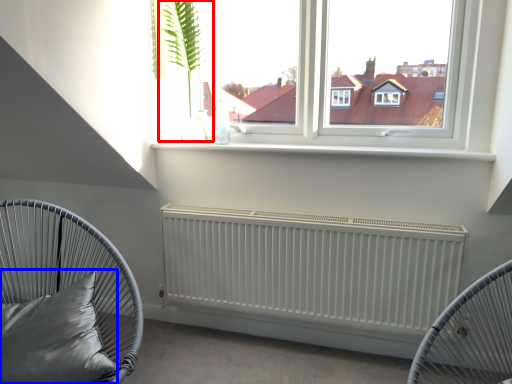
Question: Which point is further to the camera, plant (highlighted by a red box) or pillow (highlighted by a blue box)?

Choices:
 (A) plant
 (B) pillow

Answer: (A)